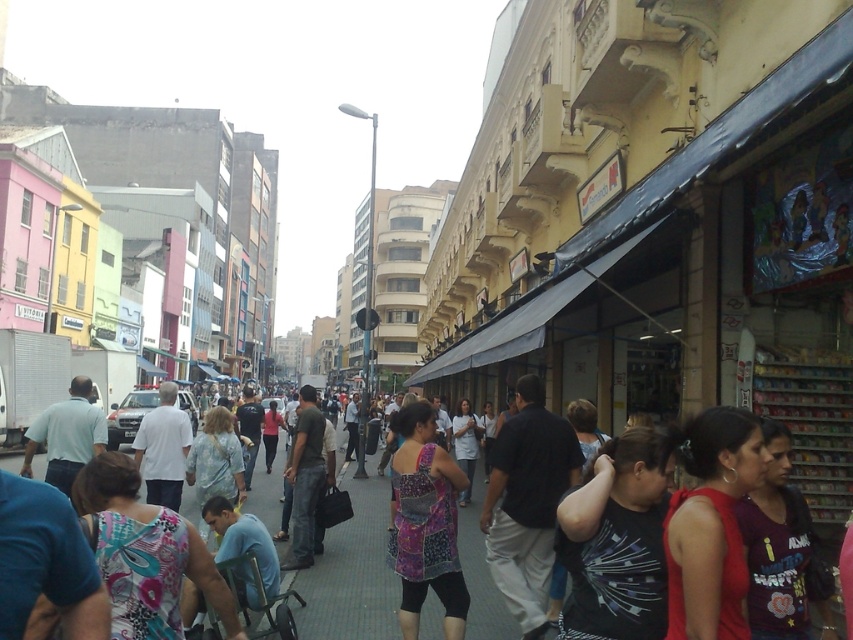
Question: Among these points, which one is nearest to the camera?

Choices:
 (A) (531, 401)
 (B) (717, 577)
 (C) (433, 528)
 (D) (606, 532)

Answer: (B)

Question: Does dark gray fabric shirt at center have a larger size compared to patchwork fabric dress at center?

Choices:
 (A) no
 (B) yes

Answer: (A)

Question: Observing the image, what is the correct spatial positioning of red fabric shirt at lower right in reference to patchwork fabric dress at center?

Choices:
 (A) left
 (B) right

Answer: (B)

Question: Among these points, which one is farthest from the camera?

Choices:
 (A) (705, 547)
 (B) (524, 570)
 (C) (660, 618)
 (D) (460, 621)

Answer: (B)

Question: Can you confirm if dark gray fabric shirt at center is bigger than patchwork fabric dress at center?

Choices:
 (A) no
 (B) yes

Answer: (A)

Question: Which point is farther from the camera taking this photo?

Choices:
 (A) (426, 486)
 (B) (643, 509)

Answer: (A)